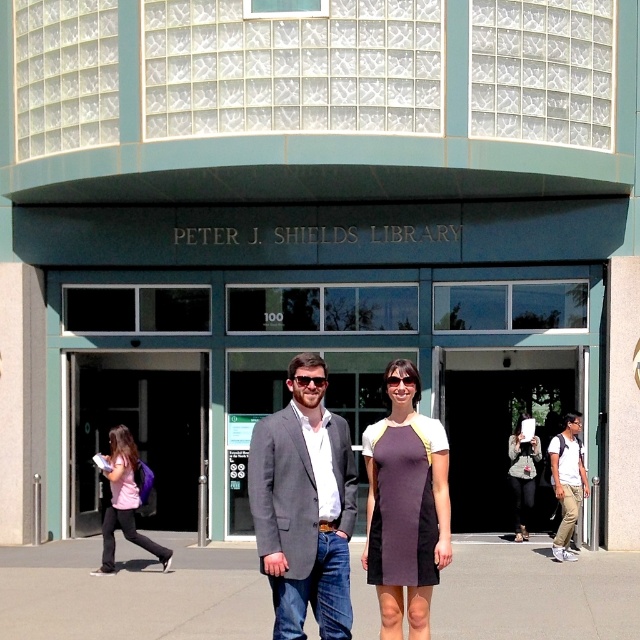
Between point (369, 582) and point (113, 454), which one is positioned in front?

Point (369, 582) is in front.

What do you see at coordinates (403, 502) in the screenshot?
I see `dark purple jersey dress at center` at bounding box center [403, 502].

Is point (384, 564) closer to camera compared to point (131, 436)?

Yes, point (384, 564) is in front of point (131, 436).

Where is `dark purple jersey dress at center`? dark purple jersey dress at center is located at coordinates (403, 502).

Describe the element at coordinates (404, 506) in the screenshot. Image resolution: width=640 pixels, height=640 pixels. I see `solid purple dress at center` at that location.

Is solid purple dress at center positioned behind white textured blouse at center?

No, it is not.

Which is in front, point (416, 595) or point (522, 454)?

Point (416, 595)

The height and width of the screenshot is (640, 640). I want to click on solid purple dress at center, so click(x=404, y=506).

Which is below, dark purple jersey dress at center or light brown leather backpack at right?

light brown leather backpack at right is lower down.

Can you confirm if dark purple jersey dress at center is positioned to the right of light brown leather backpack at right?

Incorrect, dark purple jersey dress at center is not on the right side of light brown leather backpack at right.

Where is `dark purple jersey dress at center`? dark purple jersey dress at center is located at coordinates (403, 502).